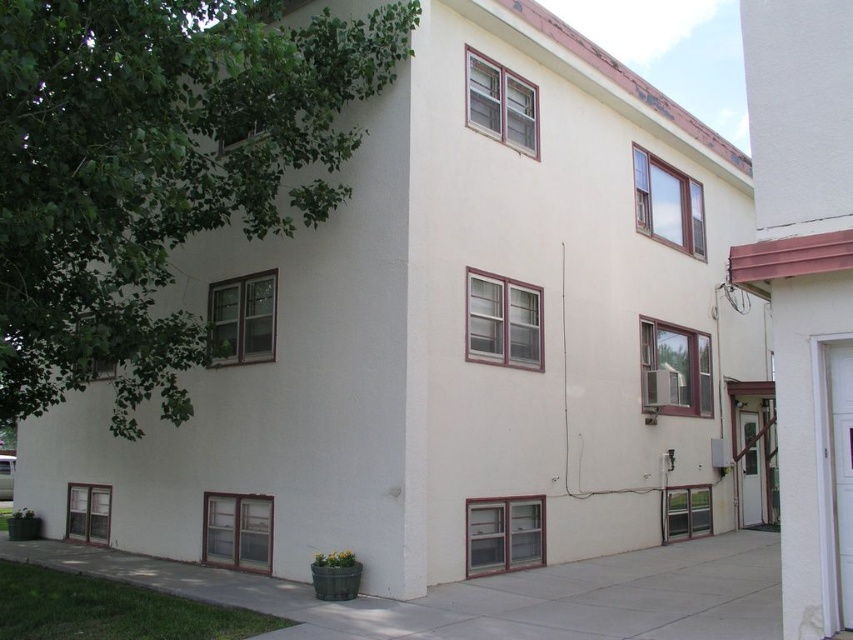
From the picture: You are a delivery person approaching the entrance of the building. You see the green leafy tree at upper left and the white glossy door at right. Which object is closer to your left side as you face the entrance?

The green leafy tree at upper left is positioned on the left side of white glossy door at right, so as you face the entrance, the green leafy tree at upper left will be closer to your left side.

You are standing at the entrance of the residential building and want to locate a specific point marked on a map. The point is labeled as point (155, 172). Based on the image description, where would this point be located relative to the green leafy tree at upper left?

The point (155, 172) is located on the green leafy tree at upper left.

You are standing at the entrance of the building and want to locate the white glossy door at right. According to the coordinates provided, where exactly is it positioned?

The white glossy door at right is located at the coordinates point (x=839, y=467).